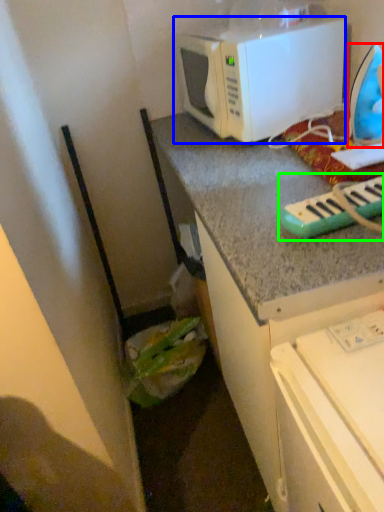
Question: Estimate the real-world distances between objects in this image. Which object is farther from appliance (highlighted by a red box), microwave oven (highlighted by a blue box) or musical keyboard (highlighted by a green box)?

Choices:
 (A) microwave oven
 (B) musical keyboard

Answer: (B)